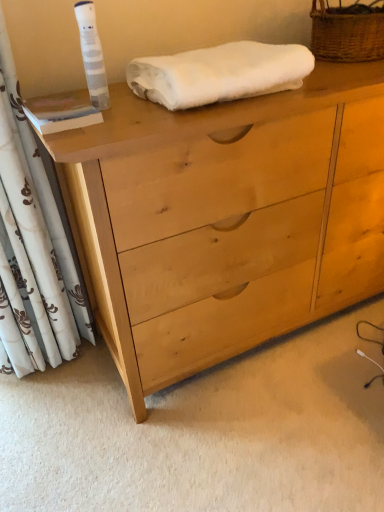
Question: Is white fluffy towel at upper center completely or partially inside white floral fabric curtain at left?

Choices:
 (A) yes
 (B) no

Answer: (B)

Question: Could you tell me if white floral fabric curtain at left is turned towards white fluffy towel at upper center?

Choices:
 (A) no
 (B) yes

Answer: (A)

Question: From a real-world perspective, is white floral fabric curtain at left positioned under white fluffy towel at upper center based on gravity?

Choices:
 (A) yes
 (B) no

Answer: (A)

Question: Is the surface of white floral fabric curtain at left in direct contact with white fluffy towel at upper center?

Choices:
 (A) no
 (B) yes

Answer: (A)

Question: Can you confirm if white floral fabric curtain at left is shorter than white fluffy towel at upper center?

Choices:
 (A) yes
 (B) no

Answer: (B)

Question: From the image's perspective, is woven brown basket at upper right positioned above or below white fluffy towel at upper center?

Choices:
 (A) below
 (B) above

Answer: (B)

Question: In terms of width, does woven brown basket at upper right look wider or thinner when compared to white fluffy towel at upper center?

Choices:
 (A) thin
 (B) wide

Answer: (A)

Question: In terms of size, does woven brown basket at upper right appear bigger or smaller than white fluffy towel at upper center?

Choices:
 (A) small
 (B) big

Answer: (A)

Question: From a real-world perspective, is woven brown basket at upper right physically located above or below white fluffy towel at upper center?

Choices:
 (A) above
 (B) below

Answer: (A)

Question: Is point [195, 120] positioned closer to the camera than point [347, 11]?

Choices:
 (A) closer
 (B) farther

Answer: (A)

Question: In terms of height, does light wood chest of drawers at center look taller or shorter compared to woven brown basket at upper right?

Choices:
 (A) short
 (B) tall

Answer: (B)

Question: Considering the relative positions of light wood chest of drawers at center and woven brown basket at upper right in the image provided, is light wood chest of drawers at center to the left or to the right of woven brown basket at upper right?

Choices:
 (A) left
 (B) right

Answer: (A)

Question: From the image's perspective, is light wood chest of drawers at center above or below woven brown basket at upper right?

Choices:
 (A) below
 (B) above

Answer: (A)

Question: Is point (41, 212) closer or farther from the camera than point (235, 249)?

Choices:
 (A) farther
 (B) closer

Answer: (A)

Question: Considering the positions of white floral fabric curtain at left and light wood chest of drawers at center in the image, is white floral fabric curtain at left wider or thinner than light wood chest of drawers at center?

Choices:
 (A) thin
 (B) wide

Answer: (A)